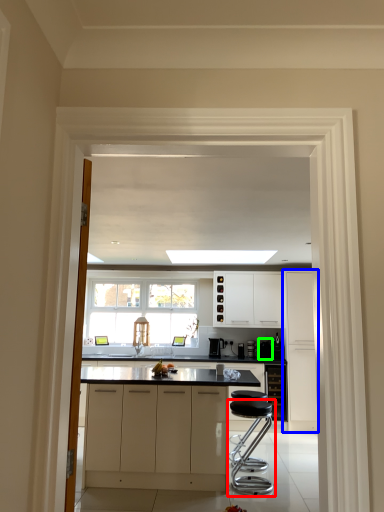
Question: Based on their relative distances, which object is farther from stool (highlighted by a red box)? Choose from cabinetry (highlighted by a blue box) and appliance (highlighted by a green box).

Choices:
 (A) cabinetry
 (B) appliance

Answer: (B)